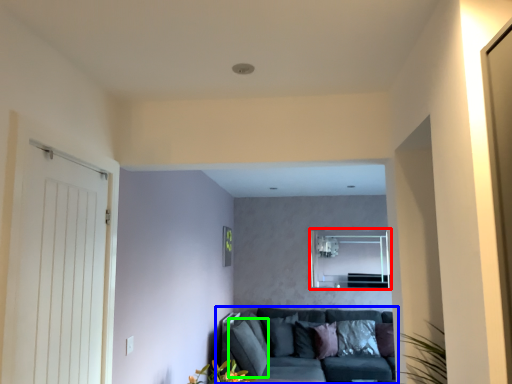
Question: Which object is the closest to the window (highlighted by a red box)? Choose among these: studio couch (highlighted by a blue box) or pillow (highlighted by a green box).

Choices:
 (A) studio couch
 (B) pillow

Answer: (A)